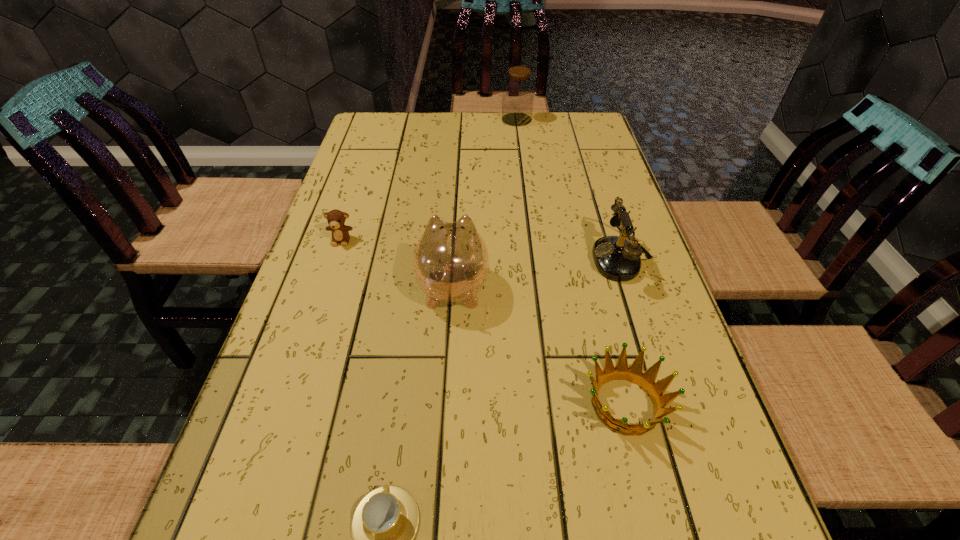
At what (x,y) coordinates should I click in order to perform the action: click on blank space located on the dial of the third tallest object. Please return your answer as a coordinate pair (x, y). This screenshot has width=960, height=540. Looking at the image, I should click on (492, 257).

Where is `free spot located on the dial of the third tallest object`? Image resolution: width=960 pixels, height=540 pixels. free spot located on the dial of the third tallest object is located at coordinates (422, 257).

The image size is (960, 540). I want to click on blank space located 0.310m on the dial of the third tallest object, so click(x=457, y=257).

Find the location of a particular element. blank space located 0.250m on the face of the leftmost object is located at coordinates click(311, 332).

Where is `vacant space located 0.080m on the back of the crown`? vacant space located 0.080m on the back of the crown is located at coordinates (607, 331).

Locate an element on the screen. object that is at the far edge is located at coordinates (518, 89).

Locate an element on the screen. object situated at the left edge is located at coordinates (340, 232).

Where is `telephone located in the right edge section of the desktop`? This screenshot has width=960, height=540. telephone located in the right edge section of the desktop is located at coordinates pos(615,257).

Find the location of a particular element. Image resolution: width=960 pixels, height=540 pixels. crown that is at the right edge is located at coordinates (634, 374).

The height and width of the screenshot is (540, 960). In the image, there is a desktop. Find the location of `vacant space at the far edge`. vacant space at the far edge is located at coordinates (532, 131).